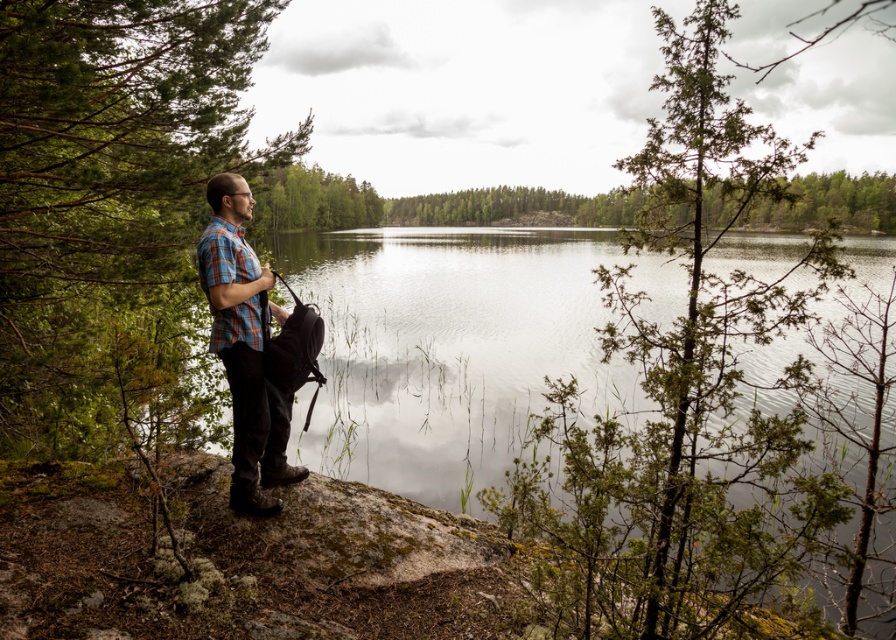
Is clear water at center below plaid fabric shirt at center?

No.

Can you confirm if clear water at center is shorter than plaid fabric shirt at center?

Incorrect, clear water at center's height does not fall short of plaid fabric shirt at center's.

Find the location of a particular element. clear water at center is located at coordinates (501, 385).